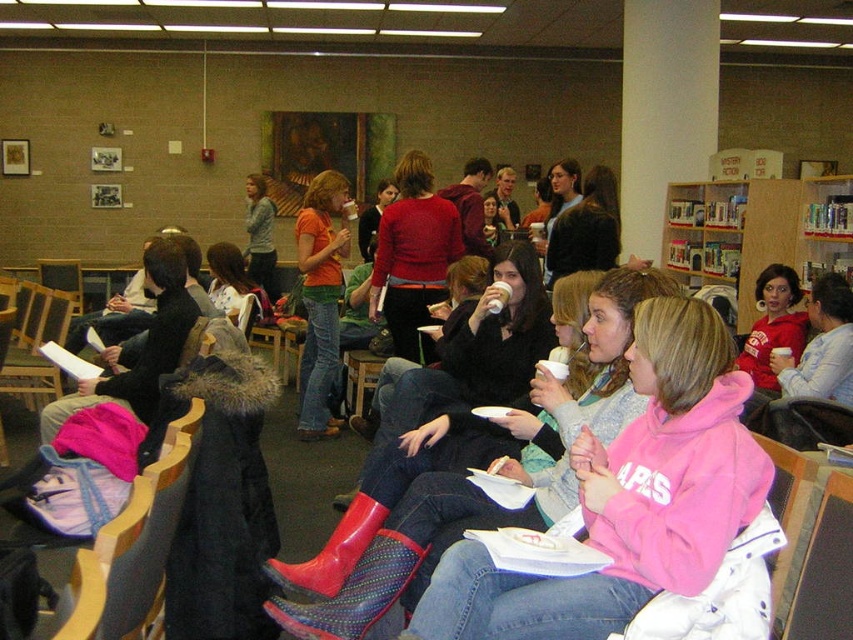
Question: Can you confirm if pink fleece sweatshirt at center is thinner than matte red hoodie at center?

Choices:
 (A) yes
 (B) no

Answer: (B)

Question: Which point is closer to the camera?

Choices:
 (A) (264, 314)
 (B) (401, 237)
 (C) (775, 250)

Answer: (B)

Question: From the image, what is the correct spatial relationship of pink fleece sweatshirt at center in relation to matte black jacket at center?

Choices:
 (A) below
 (B) above

Answer: (A)

Question: Can you confirm if wooden bookshelf at upper right is wider than matte black jacket at center?

Choices:
 (A) yes
 (B) no

Answer: (A)

Question: Estimate the real-world distances between objects in this image. Which object is farther from the wooden bookshelf at upper right?

Choices:
 (A) pink fleece sweatshirt at center
 (B) matte red sweater at center
 (C) rubber boots at center
 (D) matte black jacket at center

Answer: (A)

Question: Among these objects, which one is nearest to the camera?

Choices:
 (A) wooden bookshelf at upper right
 (B) matte red sweater at center

Answer: (B)